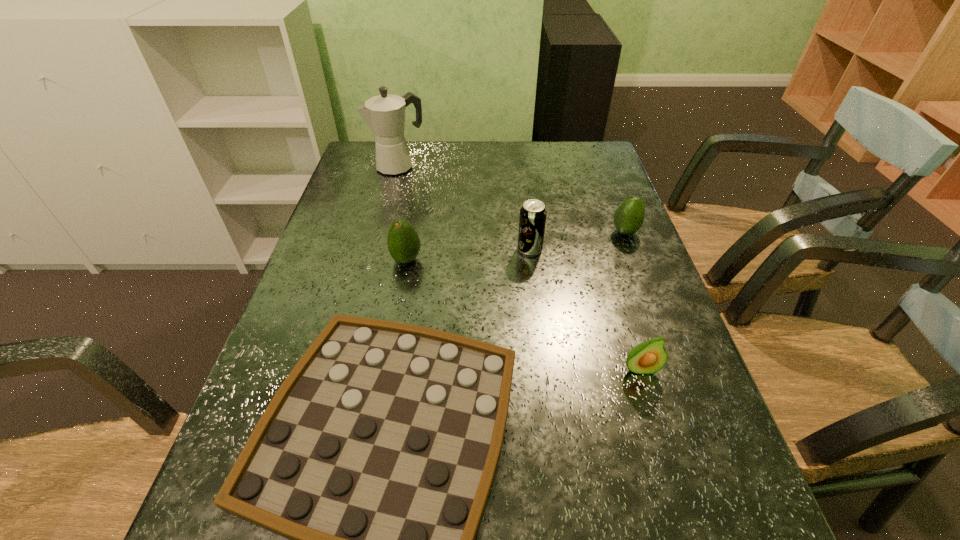
Choose which avocado is the nearest neighbor to the farthest avocado. Please provide its 2D coordinates. Your answer should be formatted as a tuple, i.e. [(x, y)], where the tuple contains the x and y coordinates of a point satisfying the conditions above.

[(648, 357)]

Identify the location of avocado that stands as the second closest to the nearest avocado. The height and width of the screenshot is (540, 960). (403, 242).